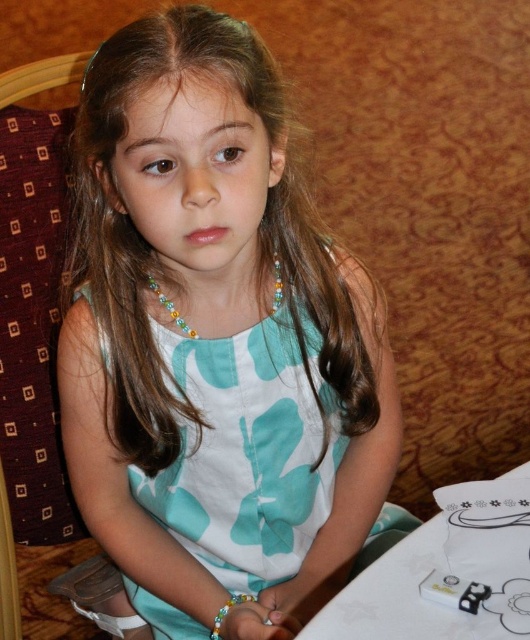
You are an artist who wants to sketch the matte teal dress at center and the white paper at lower right. Since you need to capture their positions accurately, can you tell me which object is placed above the other?

The matte teal dress at center is positioned over white paper at lower right, so the matte teal dress at center is above the white paper at lower right.

You are a fashion designer observing the image. You need to decide whether the matte teal dress at center can be displayed on a mannequin that is 1.5 meters tall. The multicolored beaded necklace at center must also be displayed on the same mannequin. Can both items fit on the mannequin without overlapping?

The matte teal dress at center has a greater height compared to multicolored beaded necklace at center. Since the dress is taller, it will occupy more vertical space on the mannequin. However, the necklace can be placed below or above the dress without overlapping as long as the total height does not exceed the mannequin. Since the dress is already taller than the necklace, but the mannequin is 1.5 meters tall, both items can fit as long as the dress alone does not exceed the mannequin height. The question,

You are a photographer holding a camera and want to take a photo of the girl while keeping the white paper at lower right in the frame. The camera is 23.78 inches away from the white paper. Is the distance sufficient to capture both the girl and the paper in the same shot?

The camera is 23.78 inches away from the white paper at lower right. Since the distance is specified between the camera and the paper, it depends on the camera lens and framing. However, the question doesn not provide camera specifications, so we can only confirm the distance between them is exactly 23.78 inches.